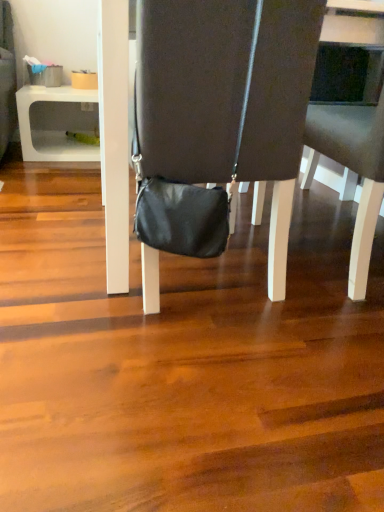
Question: From the image's perspective, is white plastic table at lower left located above or below dark gray fabric chair at center, the first chair from the right?

Choices:
 (A) below
 (B) above

Answer: (B)

Question: Considering the positions of white plastic table at lower left and dark gray fabric chair at center, the first chair from the right, in the image, is white plastic table at lower left taller or shorter than dark gray fabric chair at center, the first chair from the right,?

Choices:
 (A) short
 (B) tall

Answer: (A)

Question: Which object is positioned closest to the dark gray fabric chair at center, the first chair from the right?

Choices:
 (A) white plastic table at lower left
 (B) matte black bag at center, the 2th chair positioned from the right

Answer: (B)

Question: Based on their relative distances, which object is nearer to the matte black bag at center, marked as the first chair in a left-to-right arrangement?

Choices:
 (A) dark gray fabric chair at center, acting as the 2th chair starting from the left
 (B) white plastic table at lower left

Answer: (A)